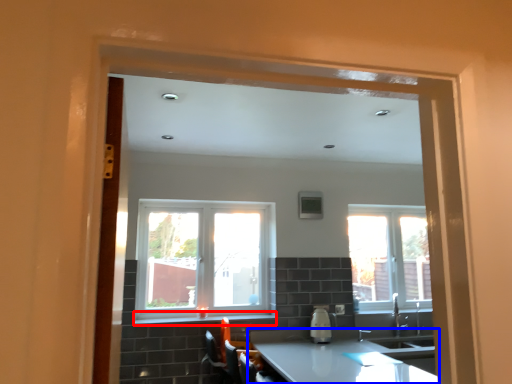
Question: Which object is further to the camera taking this photo, window sill (highlighted by a red box) or countertop (highlighted by a blue box)?

Choices:
 (A) window sill
 (B) countertop

Answer: (A)